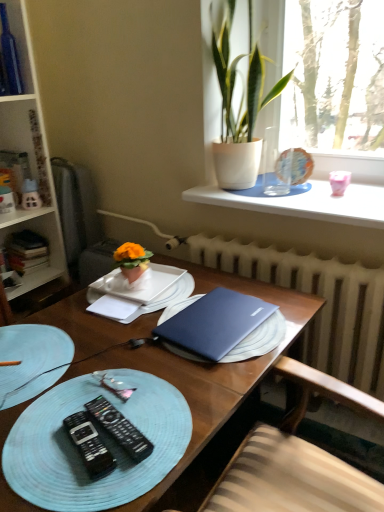
I want to click on blank space to the left of pink glossy coffee cup at upper right, so click(x=302, y=201).